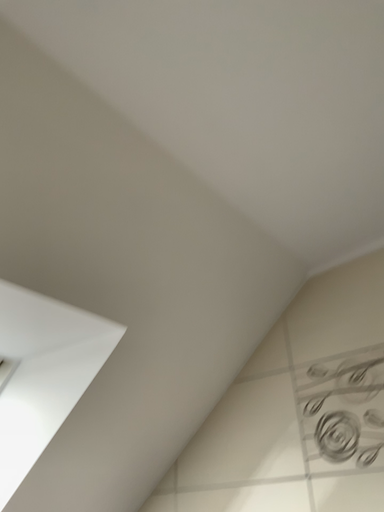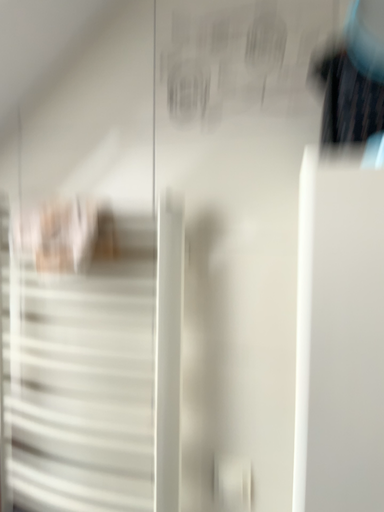
Question: Which way did the camera rotate in the video?

Choices:
 (A) rotated downward
 (B) rotated upward

Answer: (A)